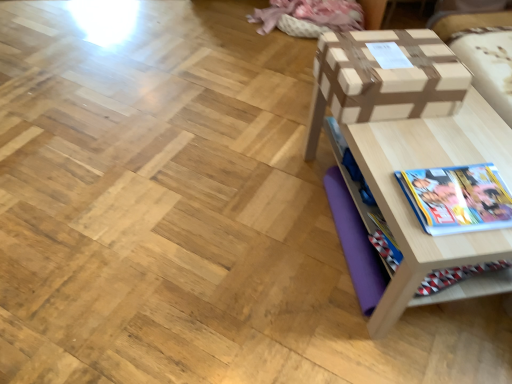
You are a GUI agent. You are given a task and a screenshot of the screen. Output one action in this format:
    pyautogui.click(x=<x>, y=<y>)
    Task: Click on the vacant space in hardcover book at lower right (from a real-world perspective)
    
    Given the screenshot: What is the action you would take?
    pyautogui.click(x=463, y=198)